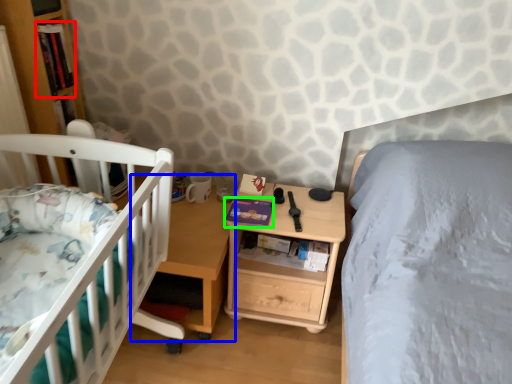
Question: Considering the real-world distances, which object is closest to book (highlighted by a red box)? table (highlighted by a blue box) or book (highlighted by a green box).

Choices:
 (A) table
 (B) book

Answer: (A)